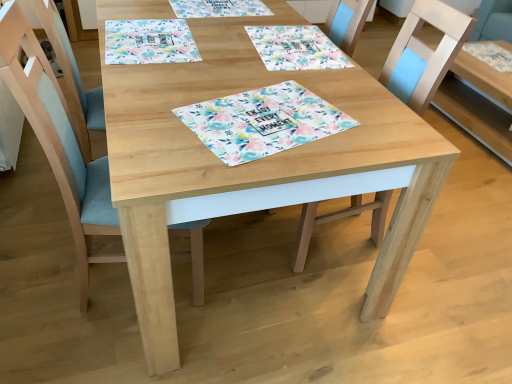
The height and width of the screenshot is (384, 512). What are the coordinates of `vacant region in front of floral paper placemat at center` in the screenshot? It's located at (236, 169).